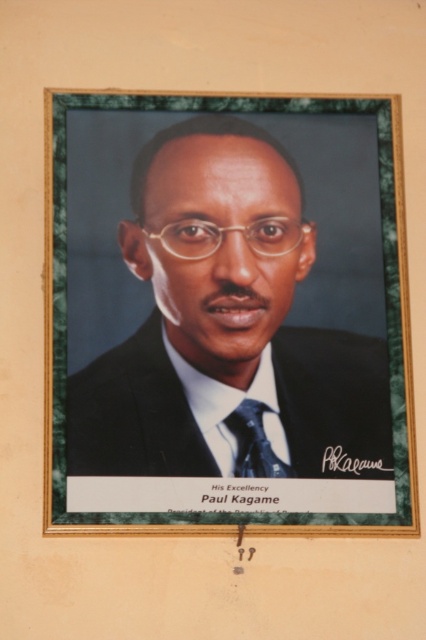
You are standing in front of the framed portrait of Paul Kagame. There are two points marked on the frame at coordinates point (399,465) and point (264,451). If you want to touch the point that is closer to you, which one should you choose?

You should choose point (264,451) because it is closer to you than point (399,465), which is further away.

You are an interior designer arranging items on a shelf. You have a wooden picture frame at center and a black silk tie at center. Given their sizes, which item will you place higher on the shelf to ensure stability?

The wooden picture frame at center has a greater height compared to the black silk tie at center, so placing it higher on the shelf will ensure stability due to its taller structure.

In the scene shown: You are standing in front of a wooden picture frame at center displaying a portrait of His Excellency Paul Kagame. If you want to read the text at the bottom of the frame, which is 16.60 feet away from you, can you do so clearly without moving closer?

The wooden picture frame at center is 16.60 feet from viewer. At that distance, it may be challenging to read the text clearly without moving closer.